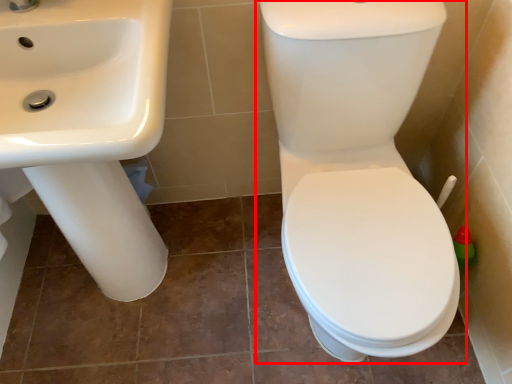
Question: In this image, where is toilet (annotated by the red box) located relative to sink?

Choices:
 (A) right
 (B) left

Answer: (A)